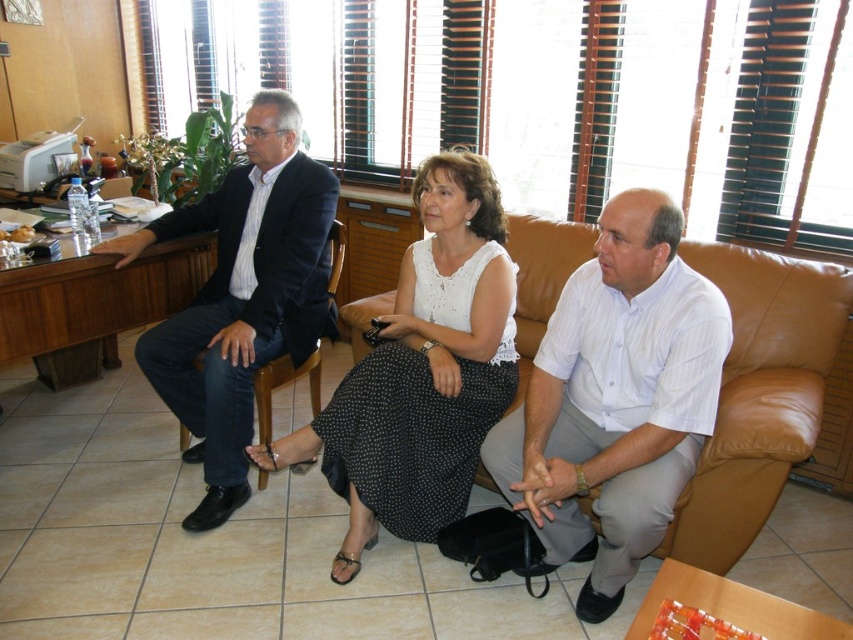
Question: Does white dotted fabric skirt at center lie behind brown leather couch at center?

Choices:
 (A) no
 (B) yes

Answer: (B)

Question: In this image, where is white striped shirt at center located relative to black leather armchair at center?

Choices:
 (A) above
 (B) below

Answer: (B)

Question: Which of the following is the closest to the observer?

Choices:
 (A) brown leather couch at center
 (B) white striped shirt at center
 (C) black leather armchair at center

Answer: (B)

Question: Which is farther from the white dotted fabric skirt at center?

Choices:
 (A) black leather armchair at center
 (B) white striped shirt at center
 (C) brown leather couch at center
 (D) matte black suit at left

Answer: (C)

Question: Which of the following is the closest to the observer?

Choices:
 (A) white striped shirt at center
 (B) white dotted fabric skirt at center

Answer: (A)

Question: Is matte black suit at left wider than black leather armchair at center?

Choices:
 (A) yes
 (B) no

Answer: (A)